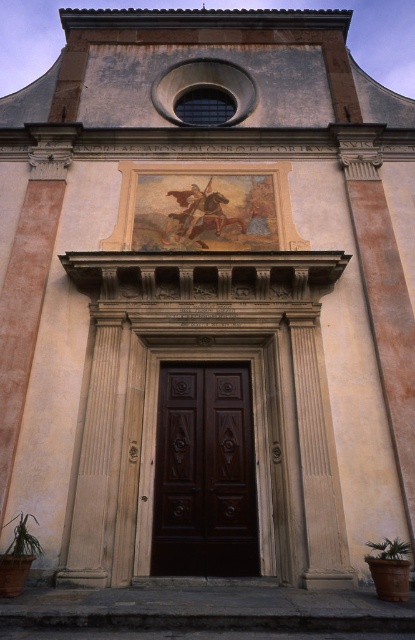
Does dark wood door at center lie behind green leafy plant at lower right?

Yes.

Does dark wood door at center appear on the left side of green leafy plant at lower right?

Correct, you'll find dark wood door at center to the left of green leafy plant at lower right.

Describe the element at coordinates (205, 472) in the screenshot. I see `dark wood door at center` at that location.

At what (x,y) coordinates should I click in order to perform the action: click on dark wood door at center. Please return your answer as a coordinate pair (x, y). The width and height of the screenshot is (415, 640). Looking at the image, I should click on (205, 472).

Is green leafy plant at lower left positioned behind green leafy plant at lower right?

No, it is in front of green leafy plant at lower right.

The height and width of the screenshot is (640, 415). Identify the location of green leafy plant at lower left. (21, 541).

At what (x,y) coordinates should I click in order to perform the action: click on green leafy plant at lower left. Please return your answer as a coordinate pair (x, y). The height and width of the screenshot is (640, 415). Looking at the image, I should click on (21, 541).

Is dark wood door at center below green leafy plant at lower left?

No, dark wood door at center is not below green leafy plant at lower left.

Is dark wood door at center further to the viewer compared to green leafy plant at lower left?

Yes.

Is point (173, 387) less distant than point (27, 544)?

No, it is not.

Identify the location of dark wood door at center. (205, 472).